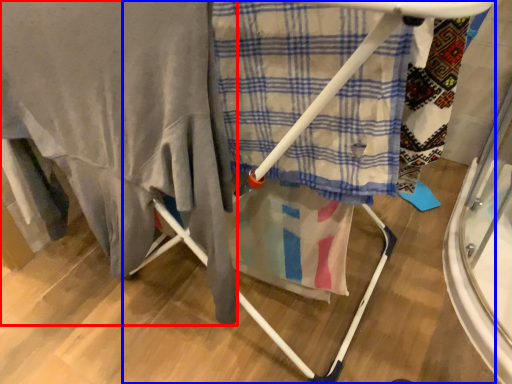
Question: Which of the following is the closest to the observer, blanket (highlighted by a red box) or furniture (highlighted by a blue box)?

Choices:
 (A) blanket
 (B) furniture

Answer: (B)